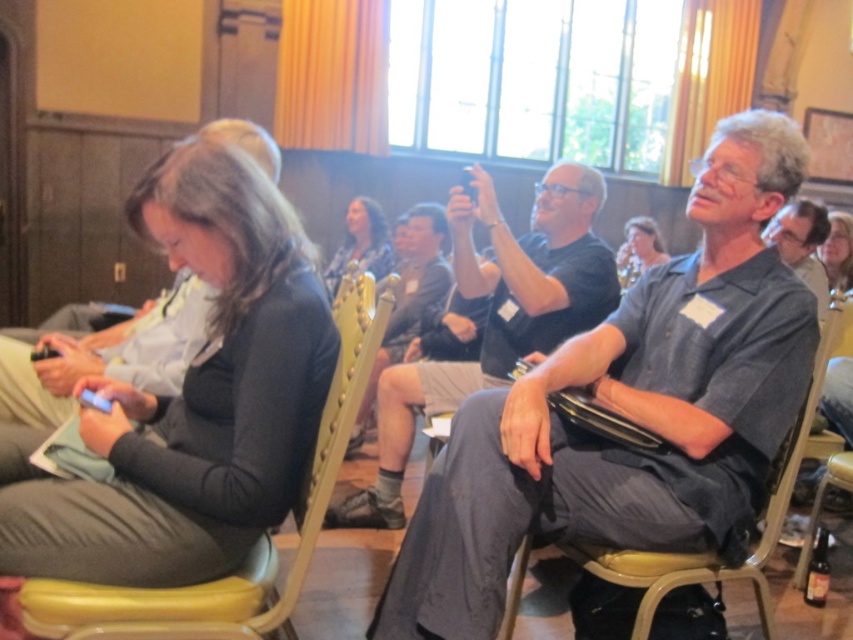
Question: Can you confirm if metallic gray chair at right is bigger than matte black hair at upper center?

Choices:
 (A) no
 (B) yes

Answer: (A)

Question: Which point is closer to the camera taking this photo?

Choices:
 (A) (548, 228)
 (B) (834, 246)

Answer: (A)

Question: Does yellow vinyl chair at lower left have a smaller size compared to metallic gray chair at right?

Choices:
 (A) yes
 (B) no

Answer: (A)

Question: Does black matte shirt at center appear under smooth brown hair at center?

Choices:
 (A) no
 (B) yes

Answer: (B)

Question: Which object is closer to the camera taking this photo?

Choices:
 (A) metallic gray chair at right
 (B) black matte shirt at center

Answer: (A)

Question: Which point appears farthest from the camera in this image?

Choices:
 (A) (796, 144)
 (B) (361, 252)
 (C) (566, 212)

Answer: (B)